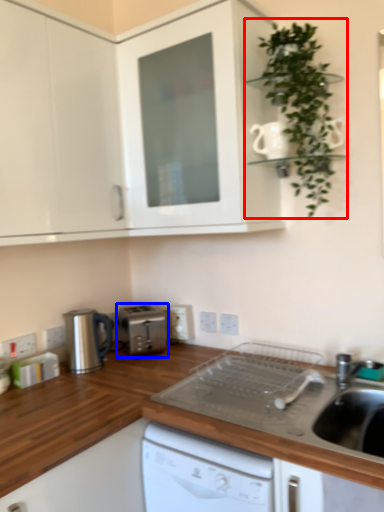
Question: Which of the following is the farthest to the observer, houseplant (highlighted by a red box) or kitchen appliance (highlighted by a blue box)?

Choices:
 (A) houseplant
 (B) kitchen appliance

Answer: (B)